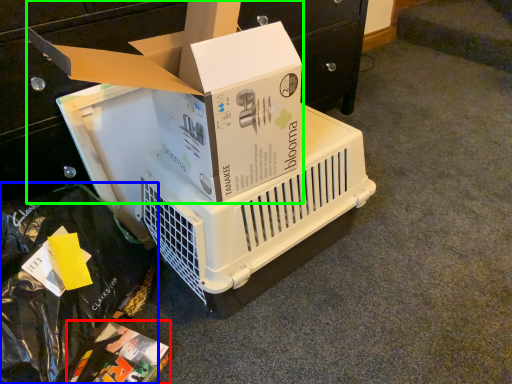
Question: Estimate the real-world distances between objects in this image. Which object is farther from box (highlighted by a red box), garbage (highlighted by a blue box) or box (highlighted by a green box)?

Choices:
 (A) garbage
 (B) box

Answer: (B)